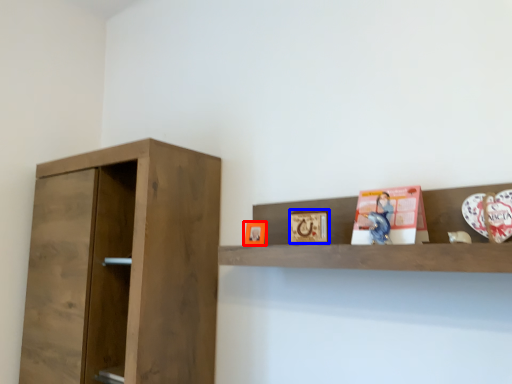
Question: Which point is closer to the camera, picture frame (highlighted by a red box) or picture frame (highlighted by a blue box)?

Choices:
 (A) picture frame
 (B) picture frame

Answer: (B)